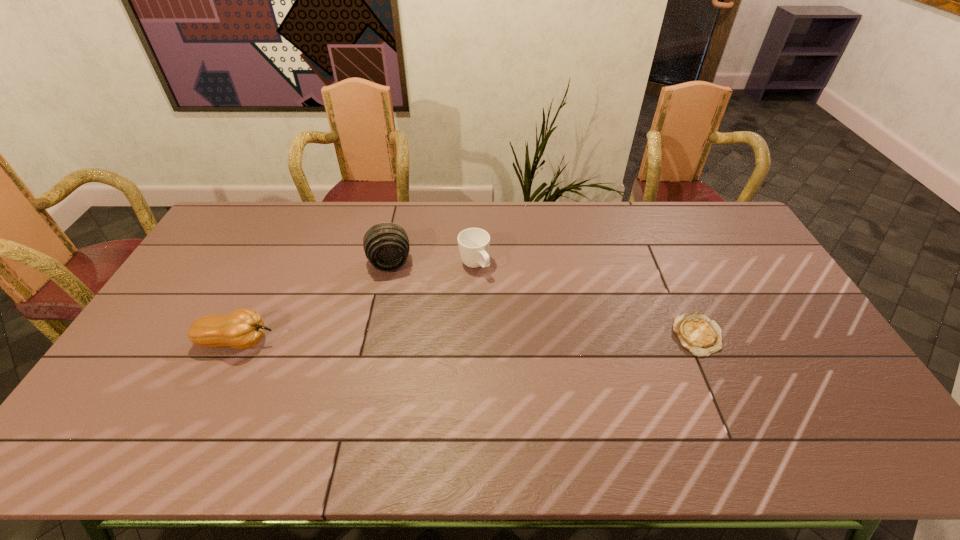
The width and height of the screenshot is (960, 540). Find the location of `vacant region located 0.390m with the handle on the side of the cup`. vacant region located 0.390m with the handle on the side of the cup is located at coordinates (553, 366).

Find the location of a particular element. This screenshot has width=960, height=540. vacant space situated 0.150m at the front element of the telephoto lens is located at coordinates (398, 310).

Where is `free space located 0.110m at the front element of the telephoto lens`? This screenshot has width=960, height=540. free space located 0.110m at the front element of the telephoto lens is located at coordinates (396, 301).

Identify the location of vacant point located at the front element of the telephoto lens. (401, 328).

Image resolution: width=960 pixels, height=540 pixels. Identify the location of object that is positioned at the left edge. (243, 328).

At what (x,y) coordinates should I click in order to perform the action: click on vacant space at the far edge of the desktop. Please return your answer as a coordinate pair (x, y). Looking at the image, I should click on click(x=499, y=210).

Find the location of a particular element. free space at the near edge is located at coordinates (298, 383).

Where is `vacant space at the left edge of the desktop`? vacant space at the left edge of the desktop is located at coordinates (155, 352).

The height and width of the screenshot is (540, 960). I want to click on vacant area at the near left corner of the desktop, so click(148, 395).

Find the location of `unoccupied area between the quiche and the leftmost object`. unoccupied area between the quiche and the leftmost object is located at coordinates (468, 339).